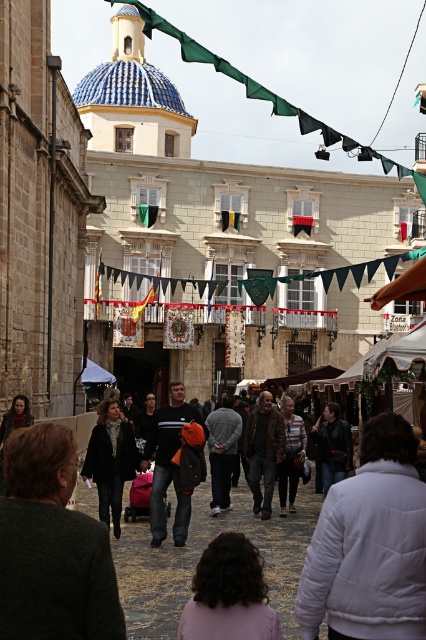
You are a street performer who wants to place a small prop on either the pink fabric at lower center or the striped sweater at center. Based on their thickness, which surface would be more stable for the prop?

The striped sweater at center is thicker than the pink fabric at lower center, so placing the prop on the striped sweater at center would provide a more stable surface.

You are a photographer trying to capture a clear shot of the dark gray sweater at center. However, there is a dark gray fabric crowd at center blocking your view. Can you estimate whether the sweater will be mostly visible through the crowd?

The dark gray sweater at center occupies less space than the dark gray fabric crowd at center, so the sweater may be mostly visible as it is smaller in size compared to the crowd blocking it.